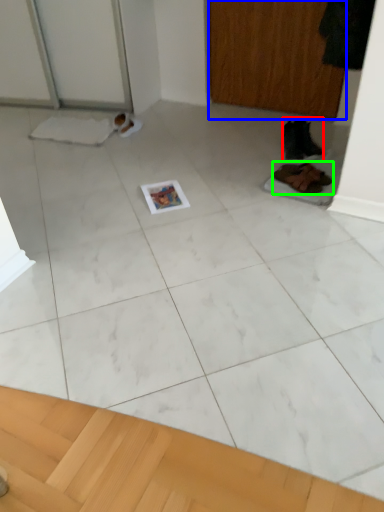
Question: Which object is positioned closest to footwear (highlighted by a red box)? Select from screen door (highlighted by a blue box) and footwear (highlighted by a green box).

Choices:
 (A) screen door
 (B) footwear

Answer: (B)